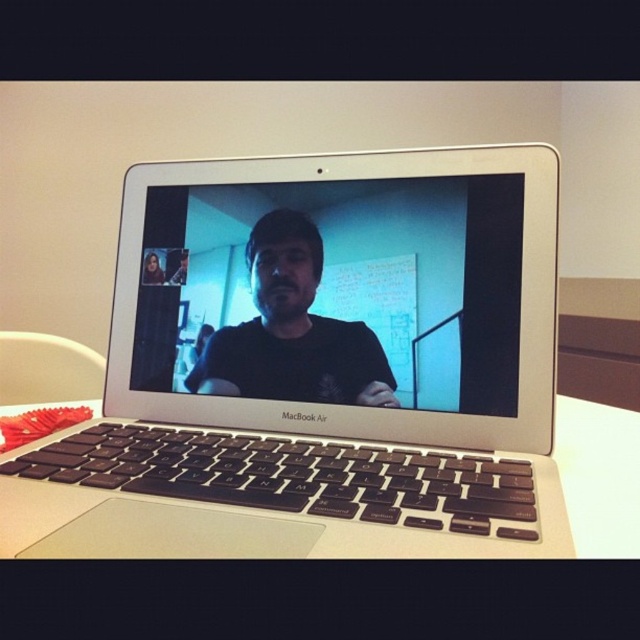
You are setting up for a video call and need to choose between the silver metallic laptop at center and the matte black laptop at center. Which one would provide a better viewing experience for participants due to its screen size?

The silver metallic laptop at center has a larger size compared to the matte black laptop at center, so it would provide a better viewing experience for participants due to its larger screen size.